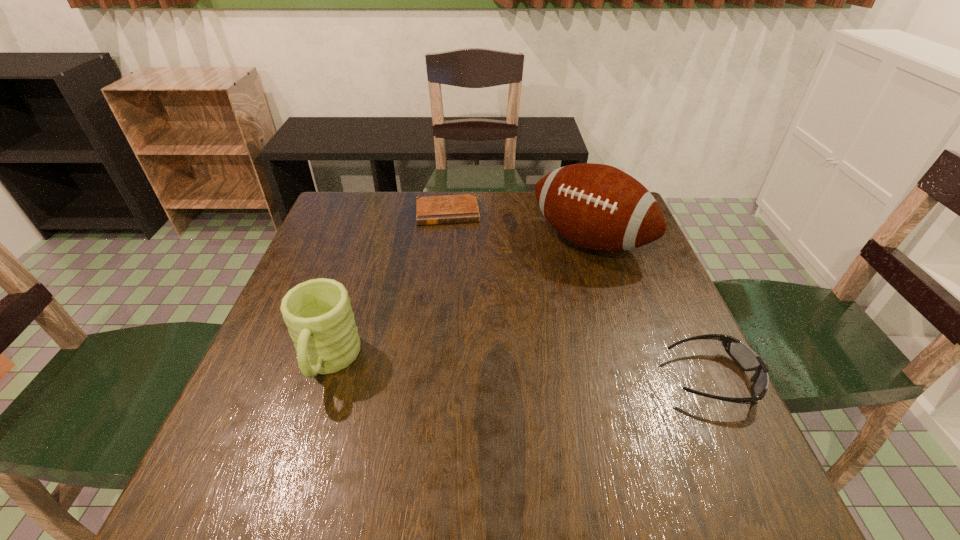
At what (x,y) coordinates should I click in order to perform the action: click on vacant space that satisfies the following two spatial constraints: 1. on the side of the second shortest object with the handle; 2. on the lenses of the leftmost object. Please return your answer as a coordinate pair (x, y). The height and width of the screenshot is (540, 960). Looking at the image, I should click on (323, 379).

This screenshot has height=540, width=960. I want to click on free space that satisfies the following two spatial constraints: 1. on the side of the second shortest object with the handle; 2. on the lenses of the second tallest object, so click(x=323, y=379).

Where is `free space that satisfies the following two spatial constraints: 1. on the side of the third tallest object with the handle; 2. on the lenses of the mug`? This screenshot has width=960, height=540. free space that satisfies the following two spatial constraints: 1. on the side of the third tallest object with the handle; 2. on the lenses of the mug is located at coordinates (323, 379).

I want to click on free space in the image that satisfies the following two spatial constraints: 1. on the front side of the tallest object; 2. on the right side of the shortest object, so click(444, 241).